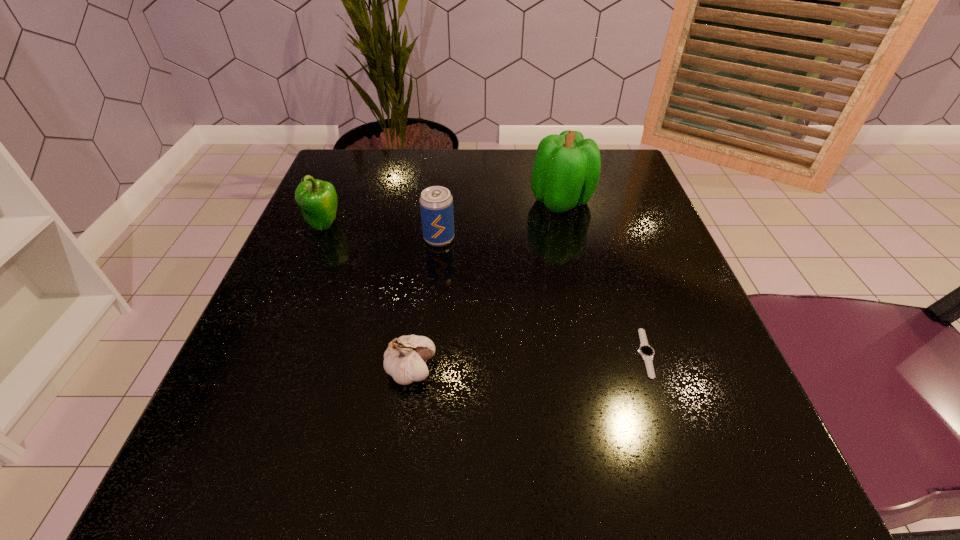
At what (x,y) coordinates should I click in order to perform the action: click on free area in between the right bell pepper and the garlic. Please return your answer as a coordinate pair (x, y). The height and width of the screenshot is (540, 960). Looking at the image, I should click on pyautogui.click(x=486, y=285).

Identify the location of free space between the beer can and the shorter bell pepper. (381, 232).

Identify which object is located as the second nearest to the right bell pepper. Please provide its 2D coordinates. Your answer should be formatted as a tuple, i.e. [(x, y)], where the tuple contains the x and y coordinates of a point satisfying the conditions above.

[(646, 352)]

Where is `object that stands as the second closest to the shortest object`? object that stands as the second closest to the shortest object is located at coordinates (404, 360).

Find the location of a particular element. The image size is (960, 540). vacant region that satisfies the following two spatial constraints: 1. on the front side of the beer can; 2. on the left side of the shortest object is located at coordinates (427, 353).

Where is `vacant area in the image that satisfies the following two spatial constraints: 1. on the back side of the beer can; 2. on the right side of the garlic`? The image size is (960, 540). vacant area in the image that satisfies the following two spatial constraints: 1. on the back side of the beer can; 2. on the right side of the garlic is located at coordinates (428, 238).